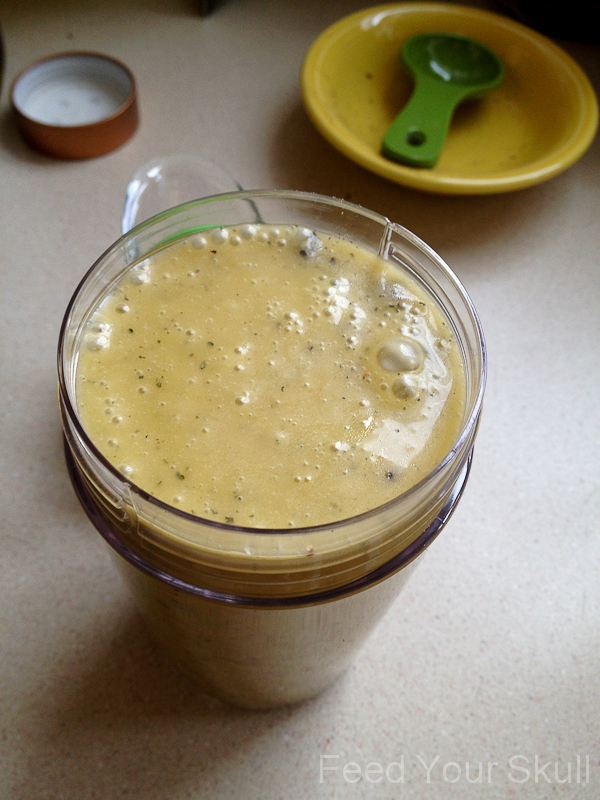
The image size is (600, 800). In order to click on spoon in this screenshot , I will do `click(430, 104)`.